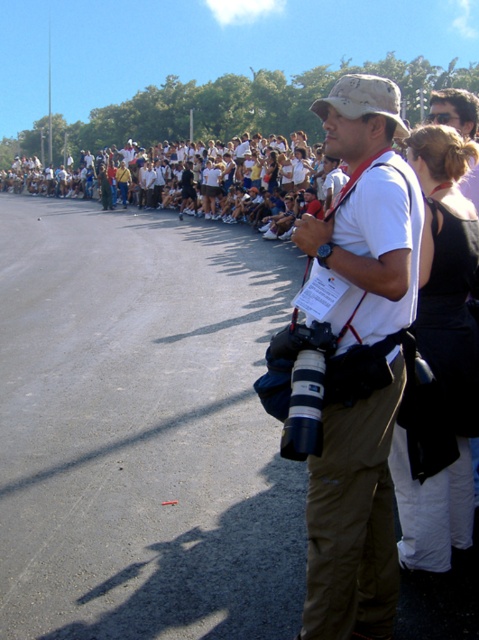
Question: Which point is farther to the camera?

Choices:
 (A) (121, 198)
 (B) (350, 472)

Answer: (A)

Question: Is white cotton shirt at center to the right of yellow fabric shirt at center from the viewer's perspective?

Choices:
 (A) yes
 (B) no

Answer: (A)

Question: Which of the following is the farthest from the observer?

Choices:
 (A) (122, 173)
 (B) (346, 529)

Answer: (A)

Question: In this image, where is white cotton shirt at center located relative to yellow fabric shirt at center?

Choices:
 (A) left
 (B) right

Answer: (B)

Question: In this image, where is white cotton shirt at center located relative to yellow fabric shirt at center?

Choices:
 (A) below
 (B) above

Answer: (A)